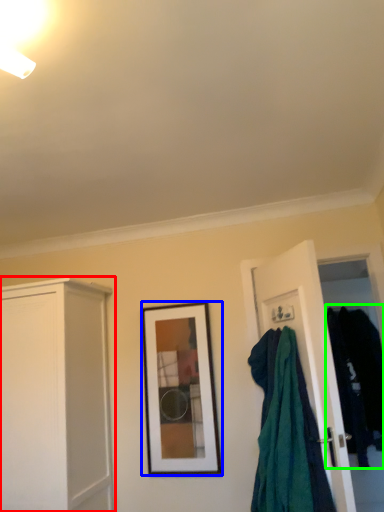
Question: Which is farther away from cabinetry (highlighted by a red box)? picture frame (highlighted by a blue box) or clothing (highlighted by a green box)?

Choices:
 (A) picture frame
 (B) clothing

Answer: (B)